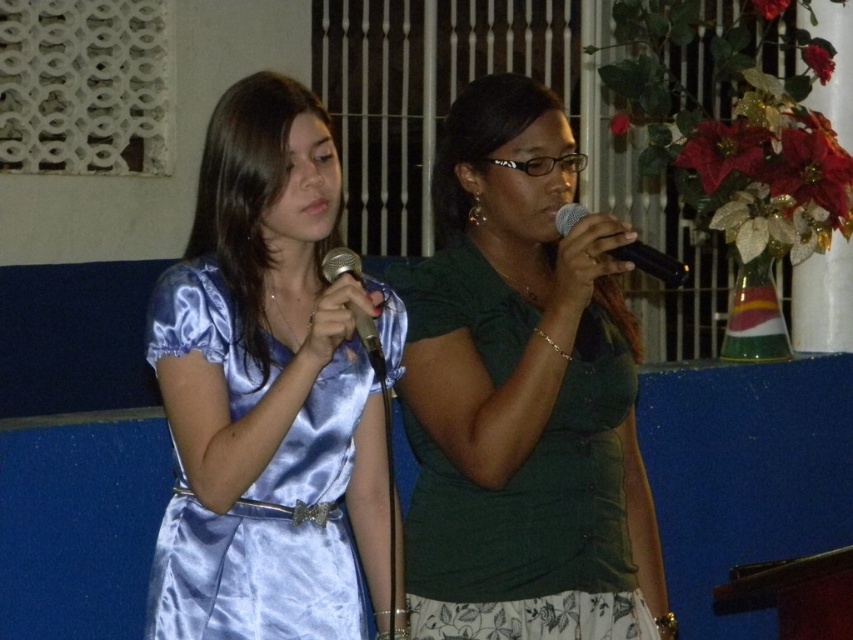
Question: Which point is farther to the camera?

Choices:
 (A) satin blue dress at center
 (B) black matte microphone at center

Answer: (A)

Question: Is black matte microphone at center further to camera compared to matte black microphone at center?

Choices:
 (A) yes
 (B) no

Answer: (A)

Question: Is satin blue dress at center to the right of matte black microphone at center from the viewer's perspective?

Choices:
 (A) yes
 (B) no

Answer: (B)

Question: Does satin blue dress at center have a smaller size compared to black matte microphone at center?

Choices:
 (A) no
 (B) yes

Answer: (A)

Question: Among these objects, which one is farthest from the camera?

Choices:
 (A) green matte shirt at center
 (B) black matte microphone at center
 (C) matte black microphone at center
 (D) satin blue dress at center

Answer: (A)

Question: Which point is farther to the camera?

Choices:
 (A) (479, 140)
 (B) (624, 259)
 (C) (223, 317)

Answer: (A)